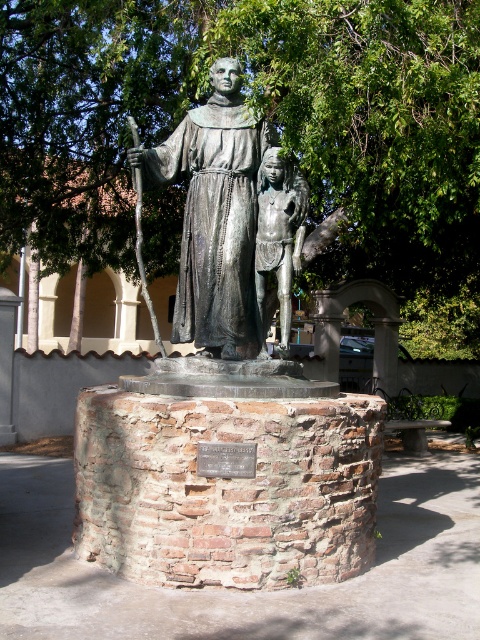
Who is shorter, green leafy tree at upper center or bronze figure at center?

bronze figure at center is shorter.

Can you confirm if green leafy tree at upper center is thinner than bronze figure at center?

No.

Describe the element at coordinates (274, 122) in the screenshot. I see `green leafy tree at upper center` at that location.

Locate an element on the screen. This screenshot has width=480, height=640. green leafy tree at upper center is located at coordinates (274, 122).

Is green leafy tree at upper center bigger than bronze statue at center?

Yes, green leafy tree at upper center is bigger than bronze statue at center.

Who is lower down, green leafy tree at upper center or bronze statue at center?

Positioned lower is bronze statue at center.

Does point (112, 61) lie in front of point (183, 262)?

That is False.

Locate an element on the screen. The height and width of the screenshot is (640, 480). green leafy tree at upper center is located at coordinates (274, 122).

Is point (302, 189) positioned behind point (276, 163)?

Yes, point (302, 189) is farther from viewer.

You are a GUI agent. You are given a task and a screenshot of the screen. Output one action in this format:
    pyautogui.click(x=<x>, y=<y>)
    Task: Click on the bronze statue at center
    This screenshot has width=480, height=640.
    Given the screenshot: What is the action you would take?
    pyautogui.click(x=225, y=218)